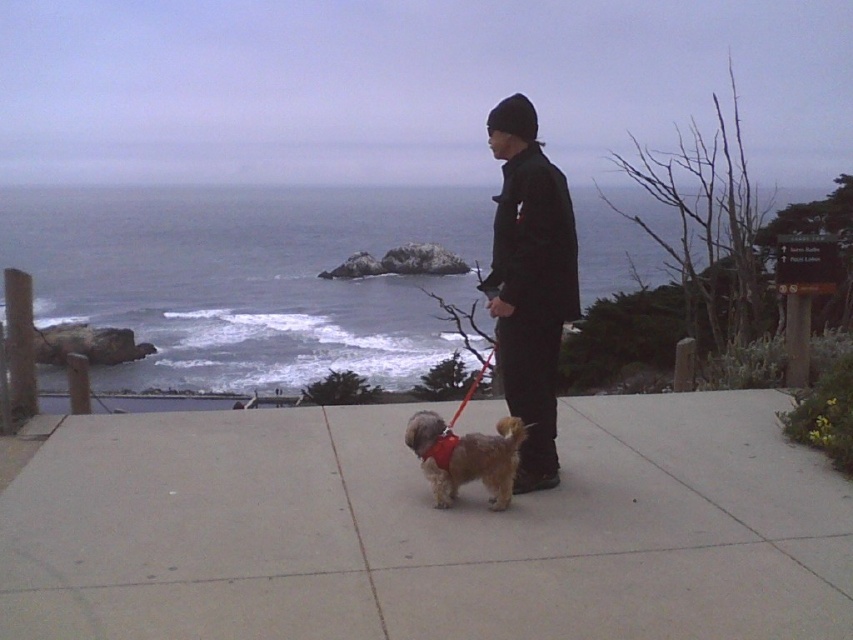
You are a photographer planning to capture a shot of the concrete sidewalk at center and the black matte jacket at center. Based on their sizes in the image, which object should you focus on first if you want to ensure both are in frame without moving the camera?

The concrete sidewalk at center is shorter than the black matte jacket at center, so you should focus on the black matte jacket at center first since it is larger and will require more attention to composition.

You are standing on the coastal path and want to walk towards the ocean. There are two points marked on the path at coordinates point (495, 310) and point (444, 465). Which point should you walk towards to get closer to the ocean faster?

Point (444, 465) is closer to the ocean than point (495, 310), so you should walk towards point (444, 465) to get closer to the ocean faster.